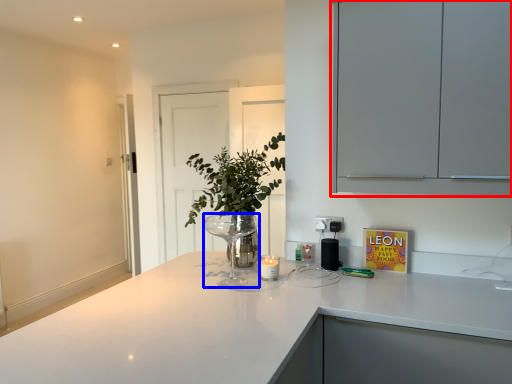
Question: Which of the following is the closest to the observer, cabinetry (highlighted by a red box) or wine glass (highlighted by a blue box)?

Choices:
 (A) cabinetry
 (B) wine glass

Answer: (A)